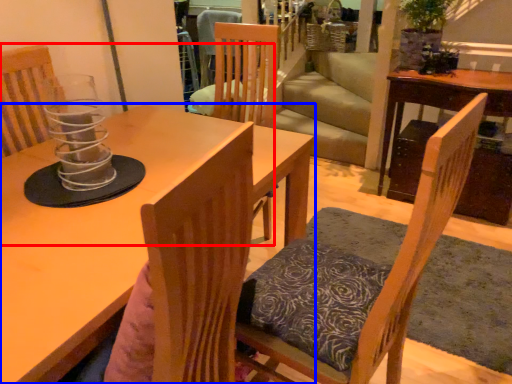
Question: Which of the following is the closest to the observer, chair (highlighted by a red box) or table (highlighted by a blue box)?

Choices:
 (A) chair
 (B) table

Answer: (B)